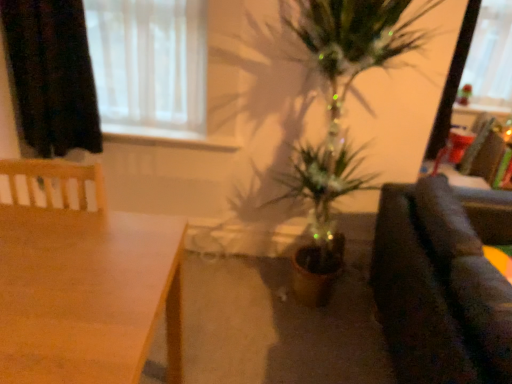
Describe the element at coordinates (86, 295) in the screenshot. I see `wooden table at lower left` at that location.

Identify the location of dark fabric couch at right. (443, 282).

This screenshot has width=512, height=384. What do you see at coordinates (51, 76) in the screenshot? I see `black fabric curtain at upper left` at bounding box center [51, 76].

The width and height of the screenshot is (512, 384). Identify the location of white sheer curtain at upper left. (149, 65).

Image resolution: width=512 pixels, height=384 pixels. What do you see at coordinates (149, 65) in the screenshot? I see `white sheer curtain at upper left` at bounding box center [149, 65].

The height and width of the screenshot is (384, 512). In order to click on transparent plastic window screen at upper right in this screenshot , I will do `click(490, 58)`.

Does white sheer curtain at upper left appear on the left side of black fabric curtain at upper left?

No, white sheer curtain at upper left is not to the left of black fabric curtain at upper left.

Is white sheer curtain at upper left positioned with its back to black fabric curtain at upper left?

Correct, white sheer curtain at upper left is looking away from black fabric curtain at upper left.

Consider the image. Is there a large distance between white sheer curtain at upper left and black fabric curtain at upper left?

No, white sheer curtain at upper left is not far away from black fabric curtain at upper left.

Considering their positions, is dark fabric couch at right located in front of or behind white sheer curtain at upper left?

Visually, dark fabric couch at right is located in front of white sheer curtain at upper left.

Where is `window that appears behind the dark fabric couch at right`? window that appears behind the dark fabric couch at right is located at coordinates (149, 65).

From the image's perspective, is dark fabric couch at right located above or below white sheer curtain at upper left?

From the image's perspective, dark fabric couch at right appears below white sheer curtain at upper left.

From a real-world perspective, is dark fabric couch at right above or below white sheer curtain at upper left?

From a real-world perspective, dark fabric couch at right is physically below white sheer curtain at upper left.

Is black fabric curtain at upper left taller or shorter than dark fabric couch at right?

In the image, black fabric curtain at upper left appears to be shorter than dark fabric couch at right.

Is dark fabric couch at right surrounded by black fabric curtain at upper left?

That's incorrect, dark fabric couch at right is not inside black fabric curtain at upper left.

Between black fabric curtain at upper left and dark fabric couch at right, which one is positioned behind?

black fabric curtain at upper left is further from the camera.

From the image's perspective, would you say dark fabric couch at right is positioned over black fabric curtain at upper left?

Actually, dark fabric couch at right appears below black fabric curtain at upper left in the image.

Is dark fabric couch at right closer to camera compared to black fabric curtain at upper left?

Yes, dark fabric couch at right is closer to the viewer.

Is black fabric curtain at upper left a part of dark fabric couch at right?

No, black fabric curtain at upper left is not a part of dark fabric couch at right.

Is white sheer curtain at upper left looking in the opposite direction of wooden table at lower left?

No, white sheer curtain at upper left is not facing the opposite direction of wooden table at lower left.

Which object is further away from the camera taking this photo, white sheer curtain at upper left or wooden table at lower left?

white sheer curtain at upper left.

Which of these two, white sheer curtain at upper left or wooden table at lower left, stands shorter?

With less height is white sheer curtain at upper left.

Based on their sizes in the image, would you say white sheer curtain at upper left is bigger or smaller than wooden table at lower left?

Considering their sizes, white sheer curtain at upper left takes up less space than wooden table at lower left.

Looking at their sizes, would you say white sheer curtain at upper left is wider or thinner than transparent plastic window screen at upper right?

In the image, white sheer curtain at upper left appears to be wider than transparent plastic window screen at upper right.

Between white sheer curtain at upper left and transparent plastic window screen at upper right, which one has more height?

With more height is transparent plastic window screen at upper right.

From the image's perspective, who appears lower, white sheer curtain at upper left or transparent plastic window screen at upper right?

white sheer curtain at upper left is shown below in the image.

Is white sheer curtain at upper left oriented towards transparent plastic window screen at upper right?

No, white sheer curtain at upper left is not oriented towards transparent plastic window screen at upper right.

Considering the positions of point (41, 302) and point (23, 112), is point (41, 302) closer or farther from the camera than point (23, 112)?

Point (41, 302) is positioned closer to the camera compared to point (23, 112).

From a real-world perspective, is wooden table at lower left positioned above or below black fabric curtain at upper left?

wooden table at lower left is below black fabric curtain at upper left.

Is there a large distance between wooden table at lower left and black fabric curtain at upper left?

No, there isn't a large distance between wooden table at lower left and black fabric curtain at upper left.

Where is `window above the black fabric curtain at upper left (from a real-world perspective)`? The width and height of the screenshot is (512, 384). window above the black fabric curtain at upper left (from a real-world perspective) is located at coordinates (149, 65).

The image size is (512, 384). I want to click on window above the dark fabric couch at right (from the image's perspective), so click(x=149, y=65).

Which object lies further to the anchor point black fabric curtain at upper left, white sheer curtain at upper left or dark fabric couch at right?

dark fabric couch at right lies further to black fabric curtain at upper left than the other object.

Based on their spatial positions, is dark fabric couch at right or transparent plastic window screen at upper right further from wooden table at lower left?

transparent plastic window screen at upper right is positioned further to the anchor wooden table at lower left.

When comparing their distances from dark fabric couch at right, does transparent plastic window screen at upper right or black fabric curtain at upper left seem further?

Based on the image, transparent plastic window screen at upper right appears to be further to dark fabric couch at right.

When comparing their distances from white sheer curtain at upper left, does wooden table at lower left or dark fabric couch at right seem closer?

The object closer to white sheer curtain at upper left is wooden table at lower left.

When comparing their distances from black fabric curtain at upper left, does dark fabric couch at right or wooden table at lower left seem closer?

wooden table at lower left is closer to black fabric curtain at upper left.

Looking at the image, which one is located closer to dark fabric couch at right, transparent plastic window screen at upper right or white sheer curtain at upper left?

white sheer curtain at upper left lies closer to dark fabric couch at right than the other object.

Consider the image. Based on their spatial positions, is transparent plastic window screen at upper right or dark fabric couch at right closer to white sheer curtain at upper left?

dark fabric couch at right lies closer to white sheer curtain at upper left than the other object.

When comparing their distances from white sheer curtain at upper left, does dark fabric couch at right or black fabric curtain at upper left seem further?

dark fabric couch at right.

The image size is (512, 384). I want to click on table between black fabric curtain at upper left and transparent plastic window screen at upper right in the horizontal direction, so click(86, 295).

Find the location of a particular element. The width and height of the screenshot is (512, 384). window between wooden table at lower left and transparent plastic window screen at upper right in the horizontal direction is located at coordinates (149, 65).

Find the location of a particular element. table between black fabric curtain at upper left and dark fabric couch at right from left to right is located at coordinates (86, 295).

Identify the location of window between wooden table at lower left and dark fabric couch at right from left to right. This screenshot has height=384, width=512. (149, 65).